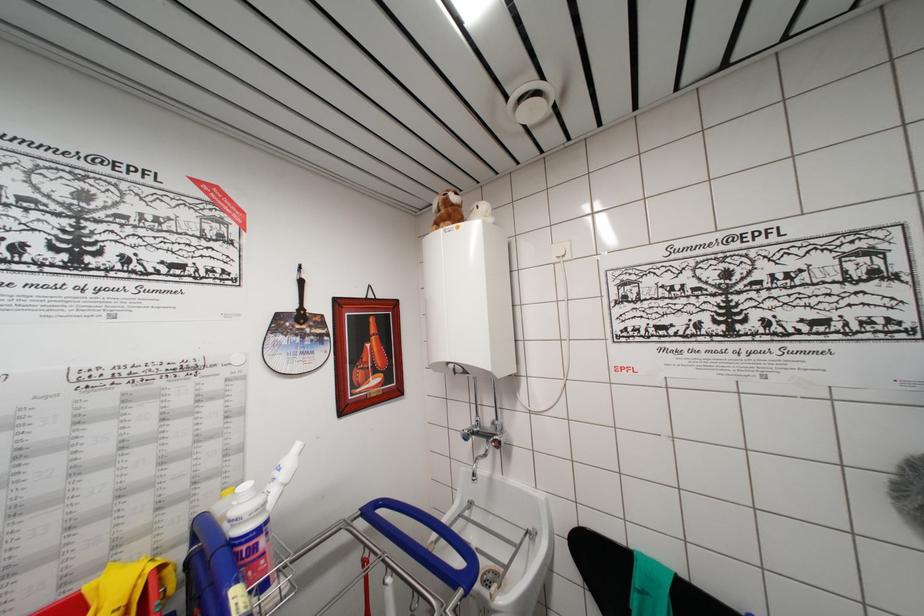
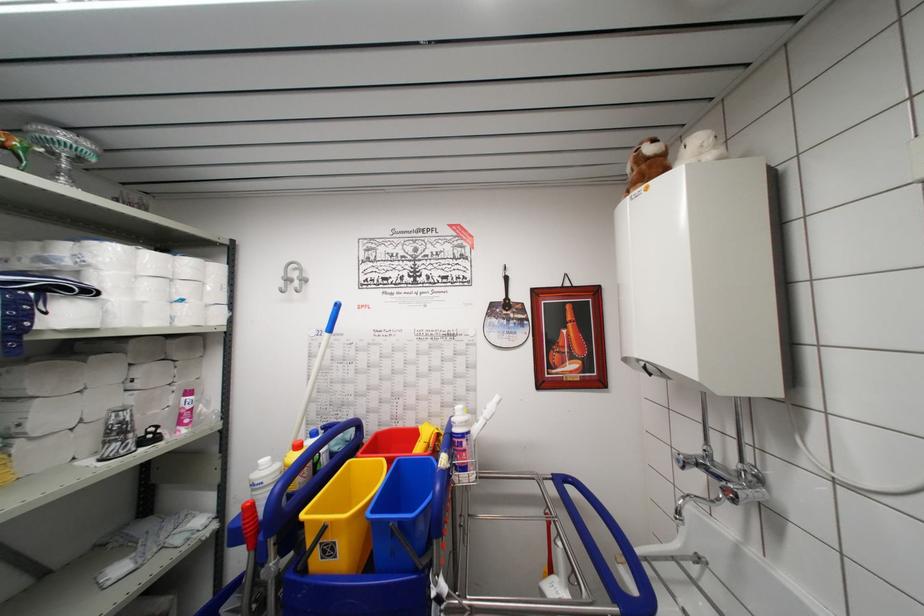
Where in the second image is the point corresponding to (305,326) from the first image?

(511, 313)